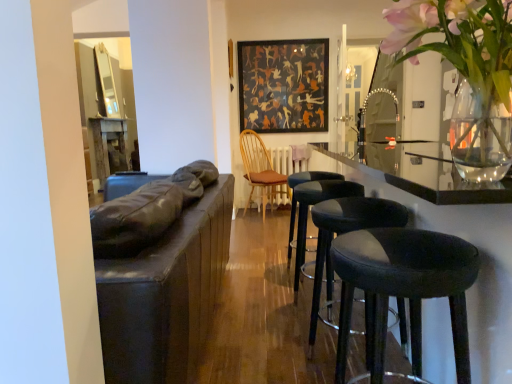
Question: Is black leather stool at center, marked as the 2th stool in a back-to-front arrangement, not close to wooden spindles chair at center?

Choices:
 (A) yes
 (B) no

Answer: (A)

Question: Is black leather stool at center, marked as the 2th stool in a back-to-front arrangement, outside wooden spindles chair at center?

Choices:
 (A) yes
 (B) no

Answer: (A)

Question: Is black leather stool at center, marked as the 2th stool in a back-to-front arrangement, facing towards wooden spindles chair at center?

Choices:
 (A) no
 (B) yes

Answer: (A)

Question: Is wooden spindles chair at center surrounded by black leather stool at center, marked as the 2th stool in a back-to-front arrangement?

Choices:
 (A) no
 (B) yes

Answer: (A)

Question: Does black leather stool at center, marked as the 2th stool in a back-to-front arrangement, have a greater height compared to wooden spindles chair at center?

Choices:
 (A) no
 (B) yes

Answer: (A)

Question: From a real-world perspective, is black leather bar stools at right positioned above or below black leather stool at center, the fourth stool in the front-to-back sequence?

Choices:
 (A) above
 (B) below

Answer: (A)

Question: Is black leather bar stools at right in front of or behind black leather stool at center, the fourth stool in the front-to-back sequence, in the image?

Choices:
 (A) front
 (B) behind

Answer: (A)

Question: From the image's perspective, is black leather bar stools at right above or below black leather stool at center, the fourth stool in the front-to-back sequence?

Choices:
 (A) above
 (B) below

Answer: (B)

Question: Considering the relative positions of black leather bar stools at right and black leather stool at center, the fourth stool in the front-to-back sequence, in the image provided, is black leather bar stools at right to the left or to the right of black leather stool at center, the fourth stool in the front-to-back sequence,?

Choices:
 (A) left
 (B) right

Answer: (B)

Question: From the image's perspective, is black leather stool at center, the fourth stool in the front-to-back sequence, positioned above or below black leather stool at lower right, marked as the 4th stool in a back-to-front arrangement?

Choices:
 (A) below
 (B) above

Answer: (B)

Question: Looking at their shapes, would you say black leather stool at center, the fourth stool in the front-to-back sequence, is wider or thinner than black leather stool at lower right, marked as the 4th stool in a back-to-front arrangement?

Choices:
 (A) thin
 (B) wide

Answer: (A)

Question: Looking at the image, does black leather stool at center, the 1th stool in the back-to-front sequence, seem bigger or smaller compared to black leather stool at lower right, which is counted as the first stool, starting from the front?

Choices:
 (A) big
 (B) small

Answer: (A)

Question: From a real-world perspective, is black leather stool at center, the fourth stool in the front-to-back sequence, physically located above or below black leather stool at lower right, which is counted as the first stool, starting from the front?

Choices:
 (A) above
 (B) below

Answer: (B)

Question: Choose the correct answer: Is black leather stool at center, the 1th stool in the back-to-front sequence, inside black leather bar stools at right or outside it?

Choices:
 (A) outside
 (B) inside

Answer: (B)

Question: Relative to black leather bar stools at right, is black leather stool at center, the 1th stool in the back-to-front sequence, in front or behind?

Choices:
 (A) front
 (B) behind

Answer: (B)